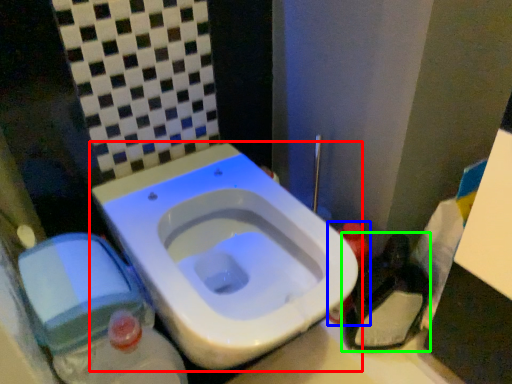
Question: Based on their relative distances, which object is farther from toilet (highlighted by a red box)? Choose from bottle (highlighted by a blue box) and garbage (highlighted by a green box).

Choices:
 (A) bottle
 (B) garbage

Answer: (B)